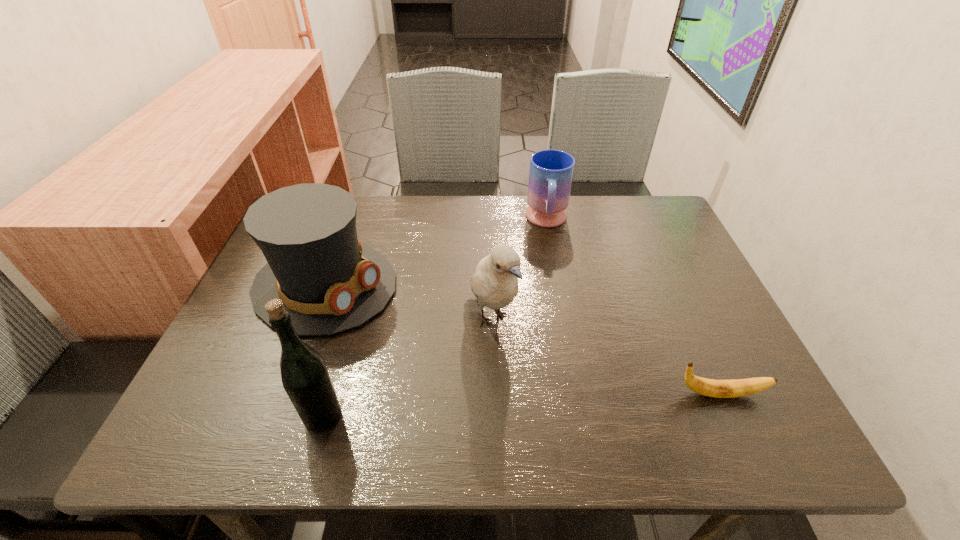
Identify the location of vacant space on the desktop that is between the tallest object and the rightmost object and is positioned with goggles on the front of the dress hat. The width and height of the screenshot is (960, 540). (577, 402).

Identify the location of vacant space on the desktop that is between the beer bottle and the rightmost object and is positioned at the beak of the third object from right to left. (546, 403).

Find the location of a particular element. The image size is (960, 540). free spot on the desktop that is between the beer bottle and the rightmost object and is positioned on the side of the second object from right to left with the handle is located at coordinates (549, 403).